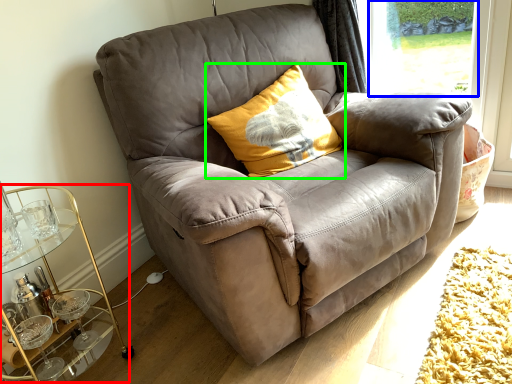
Question: Estimate the real-world distances between objects in this image. Which object is closer to cocktail table (highlighted by a red box), window screen (highlighted by a blue box) or pillow (highlighted by a green box)?

Choices:
 (A) window screen
 (B) pillow

Answer: (B)